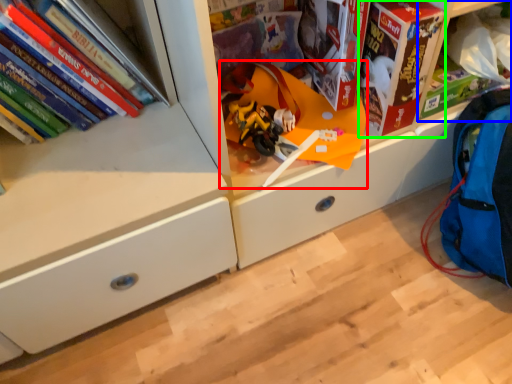
Question: Which object is the farthest from toy (highlighted by a red box)? Choose among these: shelf (highlighted by a blue box) or paperback book (highlighted by a green box).

Choices:
 (A) shelf
 (B) paperback book

Answer: (A)